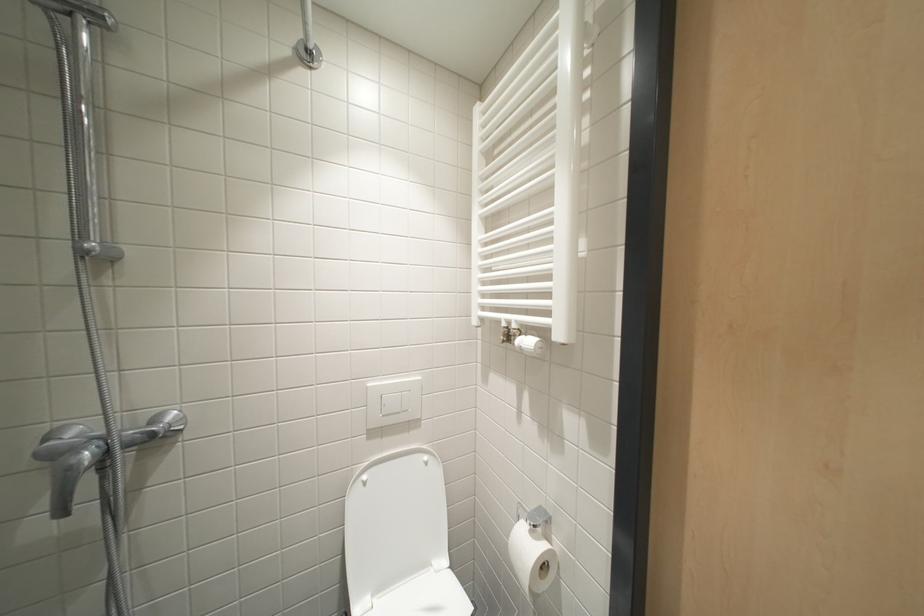
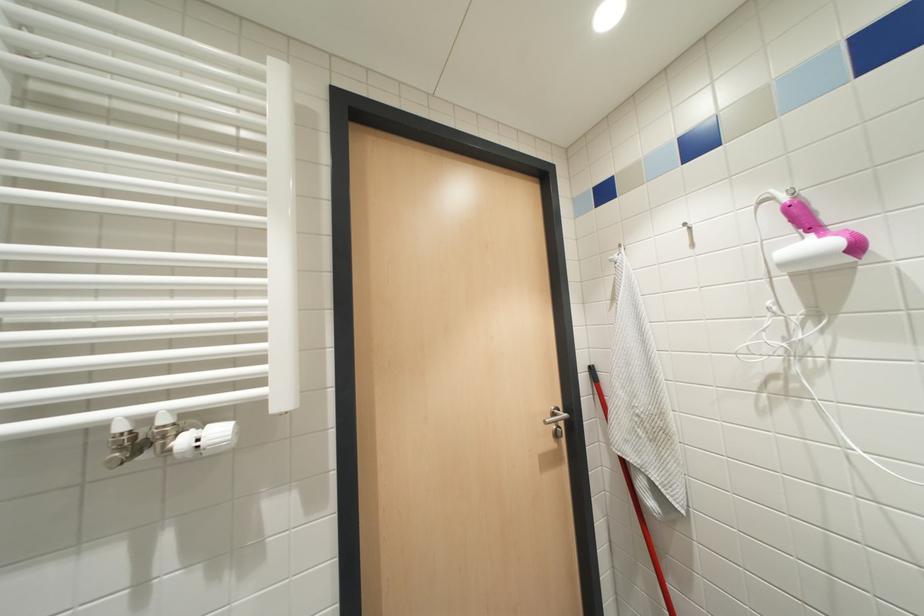
Question: How did the camera likely rotate?

Choices:
 (A) Left
 (B) Right
 (C) Up
 (D) Down

Answer: (B)